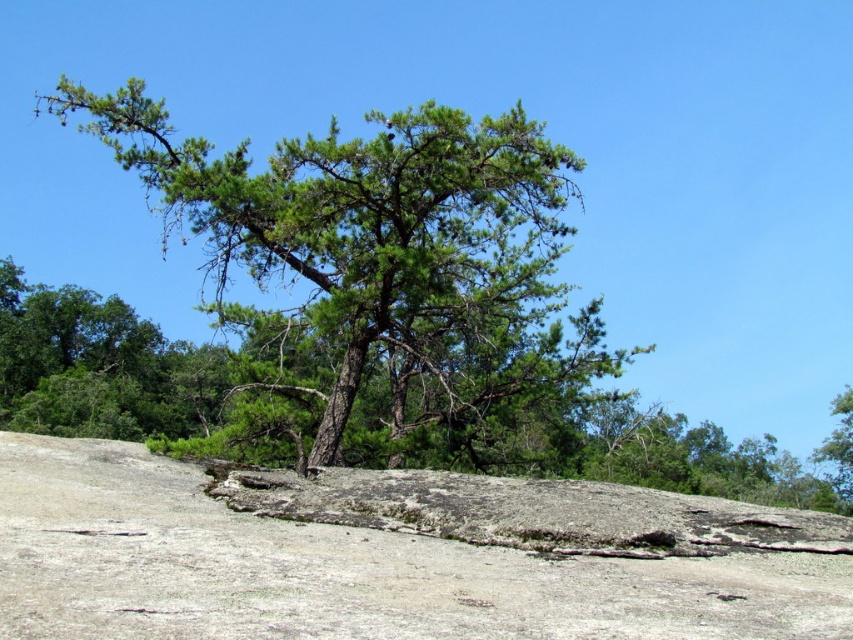
You are standing in the rugged outdoor scene and want to place a small statue on the closest object to you. Which object should you choose between the gray rock at center and the green leafy tree at upper right?

The gray rock at center is closer to the viewer than the green leafy tree at upper right, so you should place the statue on the gray rock at center.